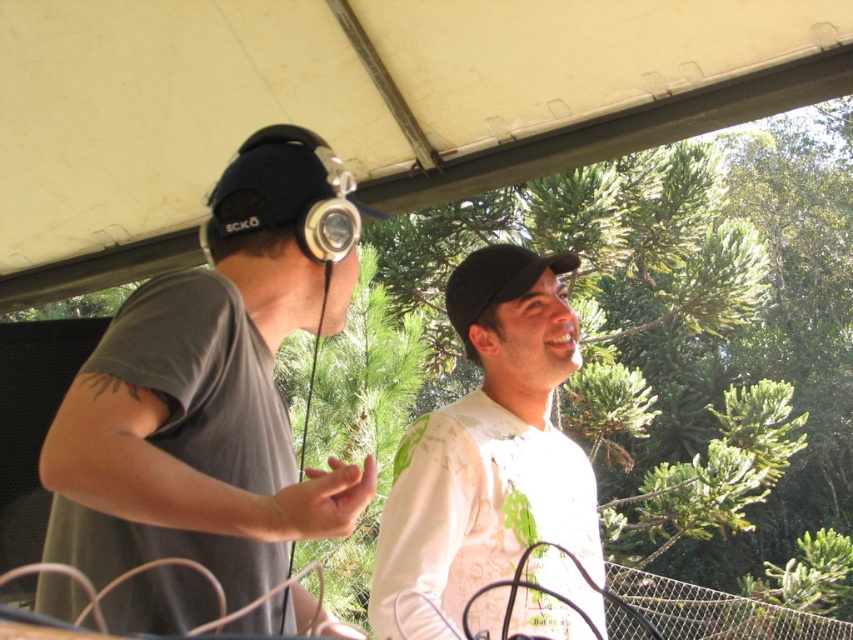
Does gray matte t-shirt at left appear under black matte baseball hat at center?

Yes.

Is point (311, 529) closer to viewer compared to point (555, 253)?

Yes, it is.

Find the location of a particular element. The width and height of the screenshot is (853, 640). gray matte t-shirt at left is located at coordinates (213, 387).

Who is shorter, gray matte t-shirt at left or white matte shirt at center?

With less height is gray matte t-shirt at left.

Is point (277, 150) positioned after point (403, 458)?

That is False.

Is point (281, 244) positioned in front of point (492, 376)?

Yes, it is.

Identify the location of gray matte t-shirt at left. This screenshot has width=853, height=640. (213, 387).

Who is more distant from viewer, (582, 552) or (474, 289)?

Positioned behind is point (474, 289).

In the scene shown: Between white matte shirt at center and black matte baseball hat at center, which one appears on the right side from the viewer's perspective?

From the viewer's perspective, black matte baseball hat at center appears more on the right side.

Is point (440, 422) positioned in front of point (567, 266)?

Yes, it is in front of point (567, 266).

The height and width of the screenshot is (640, 853). Find the location of `white matte shirt at center`. white matte shirt at center is located at coordinates (489, 444).